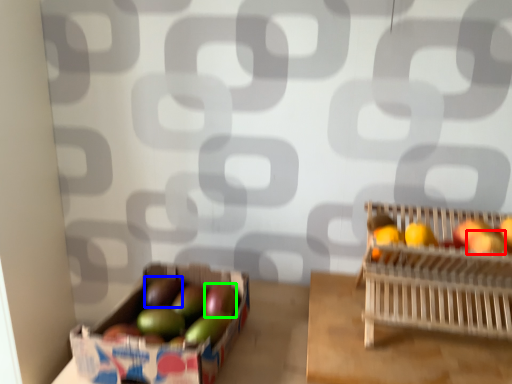
Question: Which object is positioned closest to apple (highlighted by a red box)? Select from apple (highlighted by a blue box) and apple (highlighted by a green box).

Choices:
 (A) apple
 (B) apple

Answer: (B)